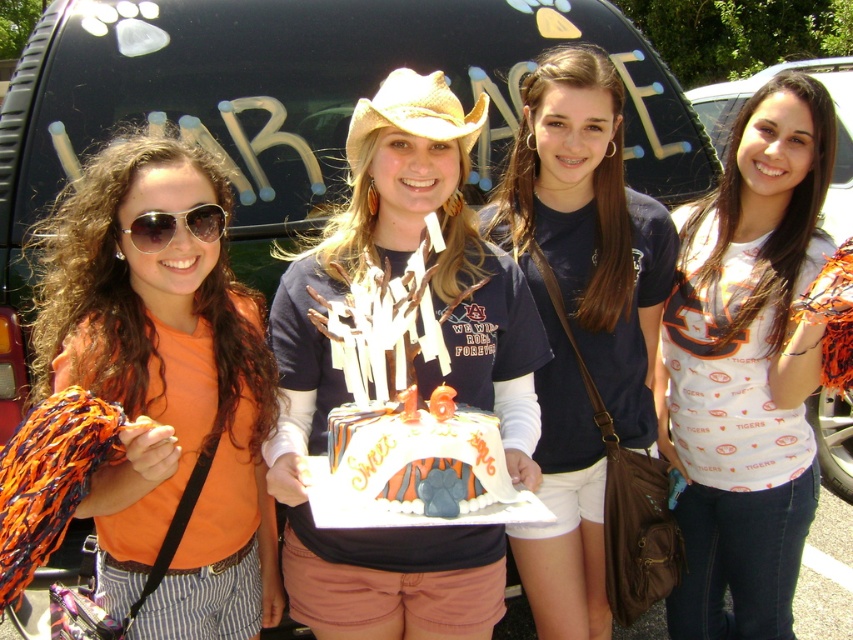
From the picture: You are standing in front of the vehicle with the word WAR on its rear window. You need to locate the matte black shirt at center. Where would you look relative to the other people in the group?

The matte black shirt at center is located at the central position among the group of four young women, at coordinates approximately 0.584 along the horizontal axis and 0.485 along the vertical axis.

Based on the photo, you are a photographer taking a picture of the group. You notice the white fondant cake at center and the white printed shirt at center. Which object is closer to the camera?

The white printed shirt at center is closer to the camera because the white fondant cake at center is positioned behind it.